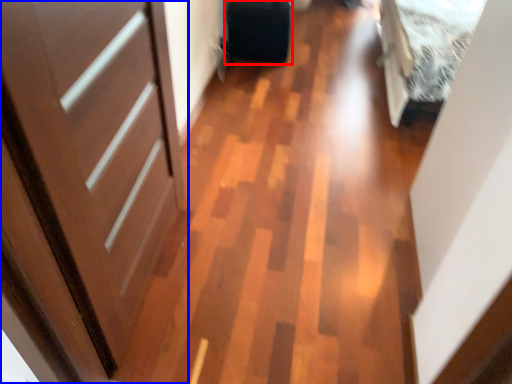
Question: Which object appears farthest to the camera in this image, luggage (highlighted by a red box) or door (highlighted by a blue box)?

Choices:
 (A) luggage
 (B) door

Answer: (A)